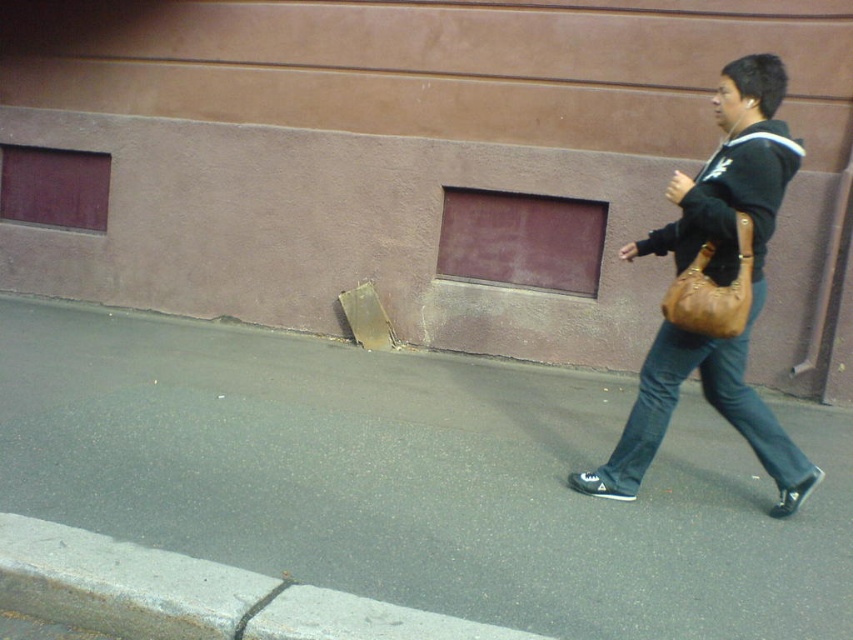
Question: Is gray asphalt at lower center positioned in front of gray concrete curb at lower left?

Choices:
 (A) yes
 (B) no

Answer: (B)

Question: Estimate the real-world distances between objects in this image. Which object is farther from the leather tan shoulder bag at right?

Choices:
 (A) gray concrete curb at lower left
 (B) dark blue denim jeans at right
 (C) gray asphalt at lower center

Answer: (A)

Question: Is gray asphalt at lower center wider than leather tan shoulder bag at right?

Choices:
 (A) no
 (B) yes

Answer: (B)

Question: Is dark blue denim jeans at right to the left of leather tan shoulder bag at right from the viewer's perspective?

Choices:
 (A) no
 (B) yes

Answer: (A)

Question: Among these points, which one is farthest from the camera?

Choices:
 (A) (782, 67)
 (B) (706, 305)
 (C) (469, 428)

Answer: (C)

Question: Among these points, which one is farthest from the camera?

Choices:
 (A) (737, 328)
 (B) (770, 554)
 (C) (73, 611)

Answer: (A)